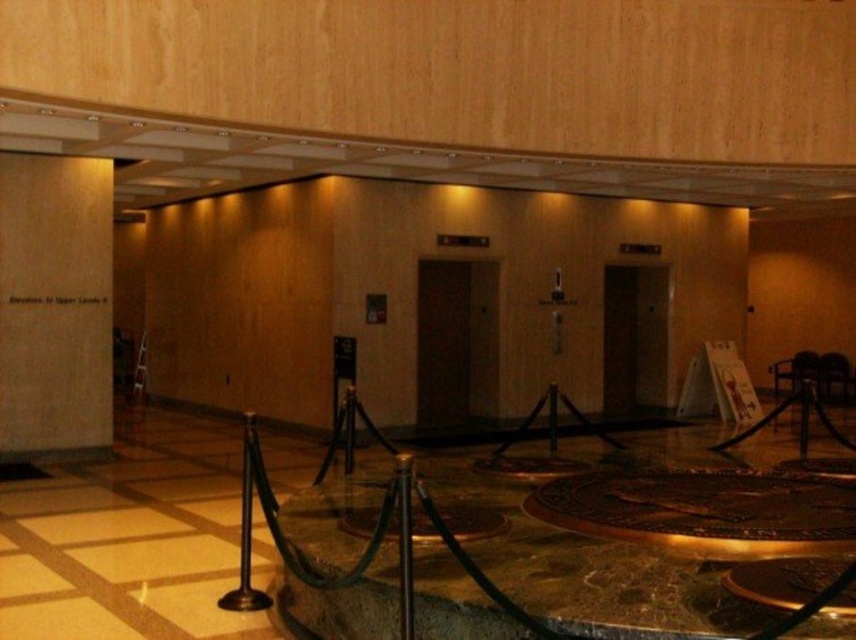
You are a visitor entering the hallway and need to locate both the wooden sign at left and the brown metallic pole at center. Which object is taller?

The wooden sign at left is taller than the brown metallic pole at center according to the description.